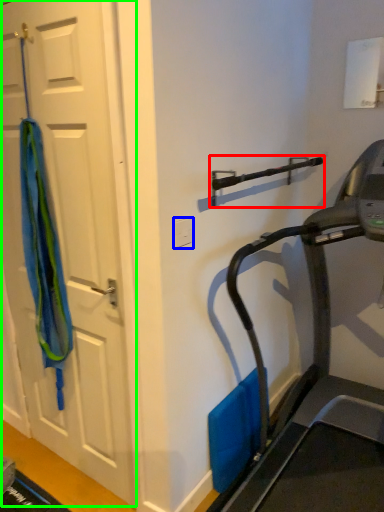
Question: Based on their relative distances, which object is farther from door handle (highlighted by a red box)? Choose from electric outlet (highlighted by a blue box) and door (highlighted by a green box).

Choices:
 (A) electric outlet
 (B) door

Answer: (B)